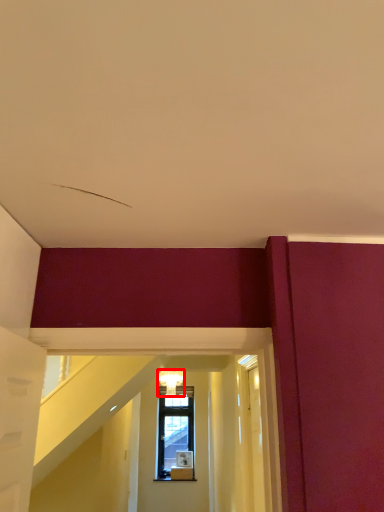
Question: From the image's perspective, where is light fixture (annotated by the red box) located in relation to glass door in the image?

Choices:
 (A) above
 (B) below

Answer: (B)